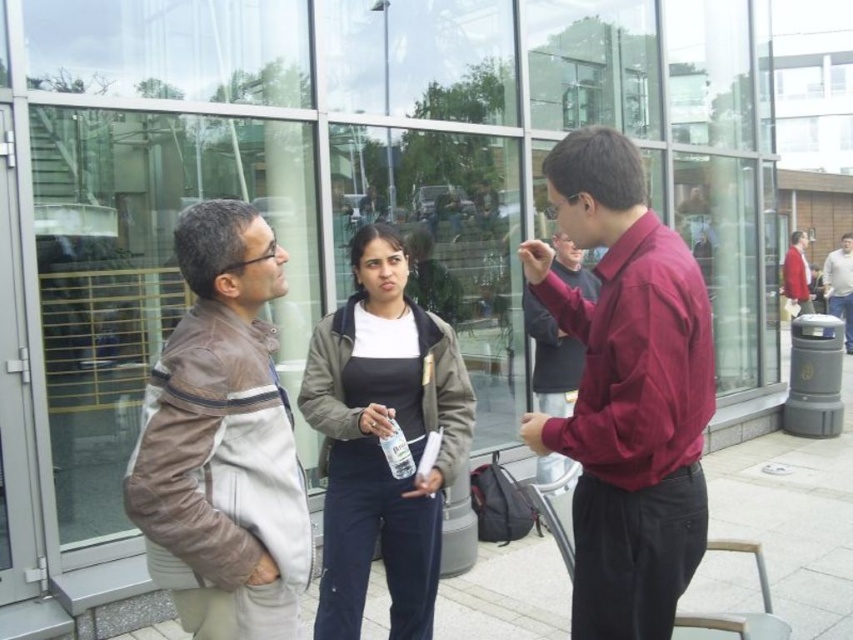
Question: Which point appears closest to the camera in this image?

Choices:
 (A) (222, 522)
 (B) (837, 262)
 (C) (375, 260)
 (D) (666, 300)

Answer: (A)

Question: Is dark green jacket at center below red cotton shirt at right?

Choices:
 (A) yes
 (B) no

Answer: (A)

Question: Which of these objects is positioned closest to the dark gray sweater at center?

Choices:
 (A) brown leather jacket at left
 (B) red cotton shirt at right
 (C) matte maroon shirt at center
 (D) dark green jacket at center

Answer: (B)

Question: Which object appears farthest from the camera in this image?

Choices:
 (A) red cotton shirt at right
 (B) matte maroon shirt at center
 (C) brown leather jacket at left

Answer: (A)

Question: Does brown leather jacket at left have a greater width compared to dark green jacket at center?

Choices:
 (A) no
 (B) yes

Answer: (A)

Question: Does brown leather jacket at left appear on the left side of dark gray sweater at center?

Choices:
 (A) yes
 (B) no

Answer: (A)